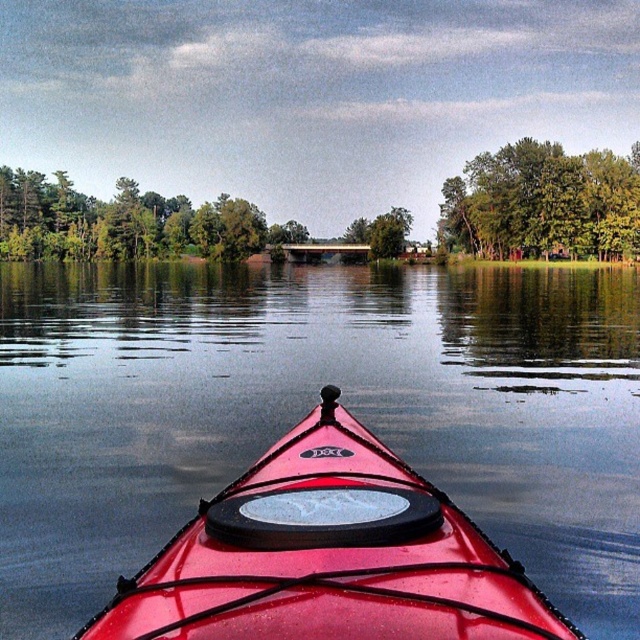
Question: Which of the following is the farthest from the observer?

Choices:
 (A) green leafy tree at upper center
 (B) green matte tree at center

Answer: (B)

Question: Which object is positioned farthest from the green leafy trees at upper center?

Choices:
 (A) shiny red kayak at center
 (B) green matte tree at center

Answer: (A)

Question: Which object is the closest to the green leafy trees at upper center?

Choices:
 (A) green leafy tree at upper center
 (B) shiny red kayak at center

Answer: (A)

Question: Does shiny red kayak at center appear on the right side of green matte tree at center?

Choices:
 (A) yes
 (B) no

Answer: (B)

Question: Observing the image, what is the correct spatial positioning of shiny red kayak at center in reference to green leafy tree at upper center?

Choices:
 (A) right
 (B) left

Answer: (B)

Question: From the image, what is the correct spatial relationship of green leafy tree at upper center in relation to green matte tree at center?

Choices:
 (A) above
 (B) below

Answer: (A)